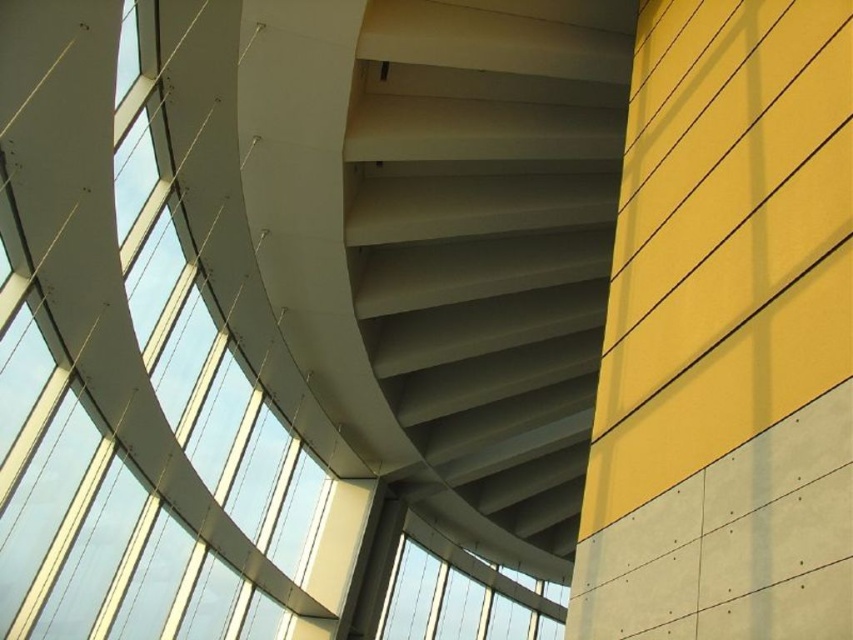
You are standing in the modern architectural interior described. You see the smooth concrete stairs at center and the transparent glass window at center. Which object is positioned higher in the scene?

The smooth concrete stairs at center are positioned higher than the transparent glass window at center according to the description.

You are standing at the entrance of the modern architectural interior. You see a point marked at coordinates (488, 236). What object is located at this point?

The point at coordinates (488, 236) is where the smooth concrete stairs at center are located.

You are an architect designing a new building. You want to ensure that the smooth concrete stairs at center are visible from the transparent glass window at center. Based on their heights, is this possible?

The smooth concrete stairs at center are taller than the transparent glass window at center, so they can be seen from the window.